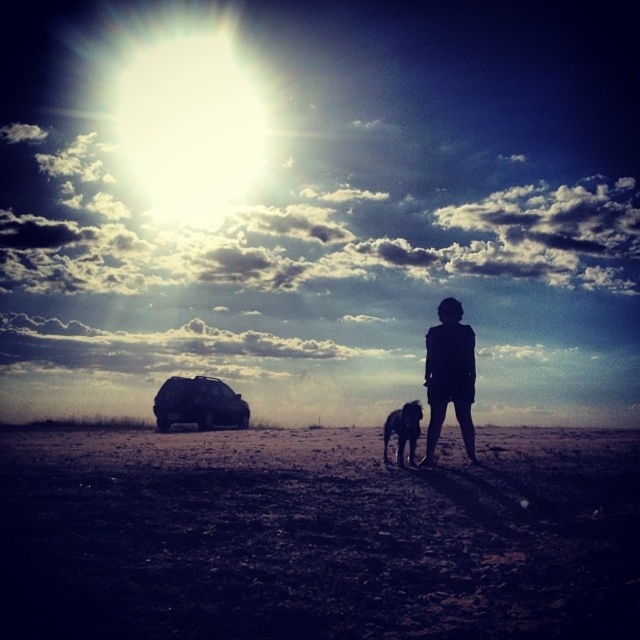
You are a photographer trying to capture a photo of the silhouette figure at center and the shiny black dog at center. Based on their sizes in the image, which one would appear closer to the camera?

The silhouette figure at center is bigger than the shiny black dog at center, so the silhouette figure at center would appear closer to the camera since larger objects in the frame typically indicate proximity to the viewer.

You are driving a car and see the image. There is a silhouette figure at center and a black matte suv at lower left. Which object is closer to you based on their positions?

The silhouette figure at center is closer to you because it is positioned to the right of the black matte suv at lower left, which is further away.

You are a photographer trying to capture the shiny black dog at center in the sunlight. The dark brown dirt field at center is in the way. Can you move the dog to a different spot where it won

The dark brown dirt field at center is positioned under the shiny black dog at center, meaning the dog is standing on the field. Since the field is part of the ground, you cannot move the dog without also moving it off the ground. Consider adjusting your camera angle or using a different background.